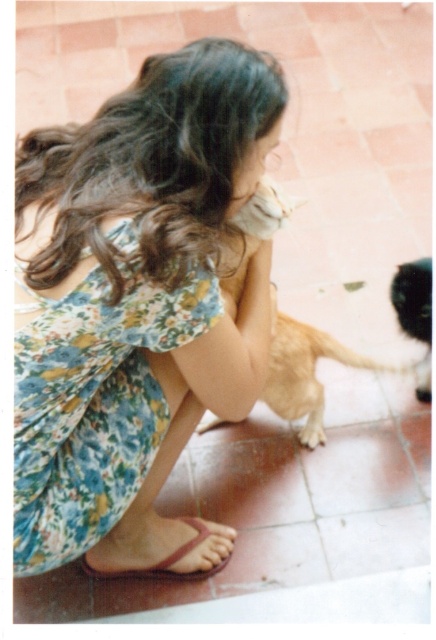
Is golden fur dog at center taller than black fuzzy cat at lower right?

In fact, golden fur dog at center may be shorter than black fuzzy cat at lower right.

How much distance is there between golden fur dog at center and black fuzzy cat at lower right?

golden fur dog at center is 10.47 inches from black fuzzy cat at lower right.

Does point (265, 228) lie behind point (418, 289)?

That is False.

Find the location of a particular element. The height and width of the screenshot is (640, 436). golden fur dog at center is located at coordinates (306, 372).

Does point (68, 522) come farther from viewer compared to point (188, 540)?

No, it is not.

Which is more to the right, floral fabric dress at center or pink leather sandal at lower center?

pink leather sandal at lower center

This screenshot has width=436, height=640. Identify the location of floral fabric dress at center. (92, 410).

Is floral fabric dress at center bigger than black fuzzy cat at lower right?

Correct, floral fabric dress at center is larger in size than black fuzzy cat at lower right.

Is floral fabric dress at center above black fuzzy cat at lower right?

Incorrect, floral fabric dress at center is not positioned above black fuzzy cat at lower right.

Where is `floral fabric dress at center`? This screenshot has height=640, width=436. floral fabric dress at center is located at coordinates coord(92,410).